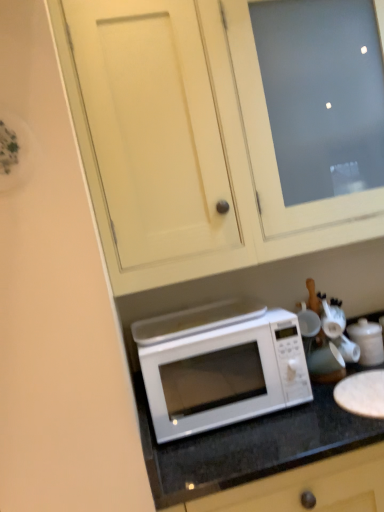
Question: Considering the positions of white glossy microwave at lower center and white matte cabinet at upper center in the image, is white glossy microwave at lower center bigger or smaller than white matte cabinet at upper center?

Choices:
 (A) big
 (B) small

Answer: (A)

Question: In terms of height, does white glossy microwave at lower center look taller or shorter compared to white matte cabinet at upper center?

Choices:
 (A) short
 (B) tall

Answer: (A)

Question: Which of these objects is positioned farthest from the white glossy microwave at center?

Choices:
 (A) white matte microwave at center
 (B) white glossy microwave at lower center
 (C) white glossy teapot at right
 (D) white matte cabinet at upper center

Answer: (C)

Question: Which is nearer to the white matte microwave at center?

Choices:
 (A) white glossy teapot at right
 (B) white glossy microwave at center
 (C) white glossy microwave at lower center
 (D) white matte cabinet at upper center

Answer: (B)